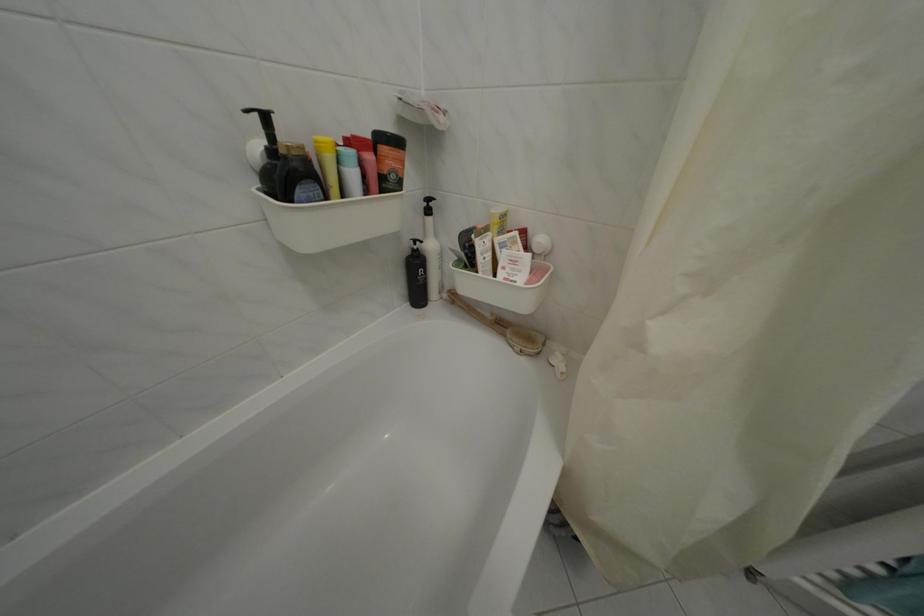
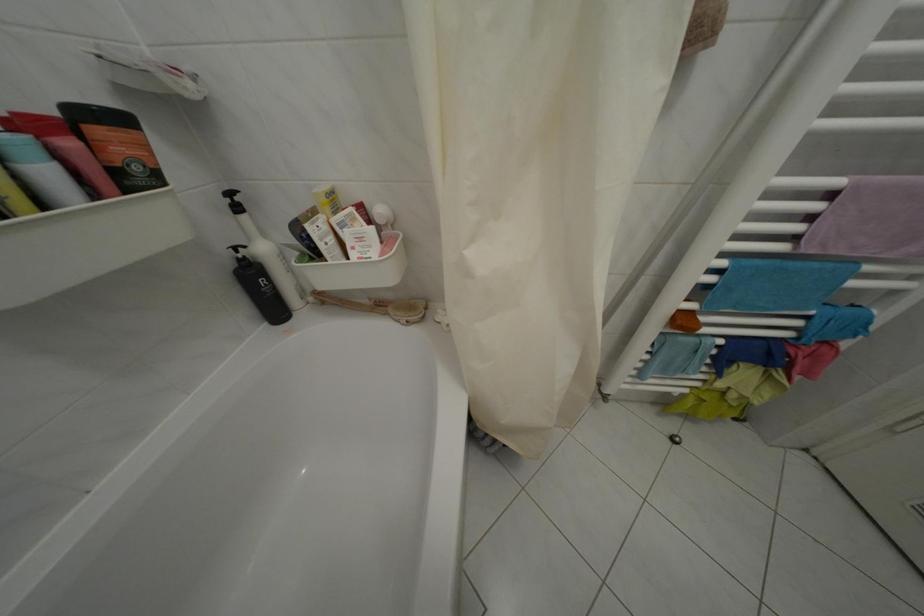
Locate, in the second image, the point that corresponds to point 424,254 in the first image.

(249, 262)